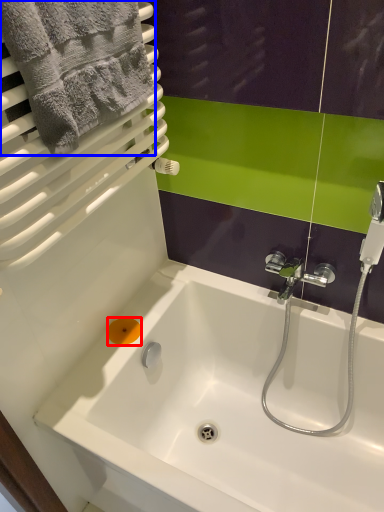
Question: Which object appears closest to the camera in this image, soap (highlighted by a red box) or towel (highlighted by a blue box)?

Choices:
 (A) soap
 (B) towel

Answer: (B)